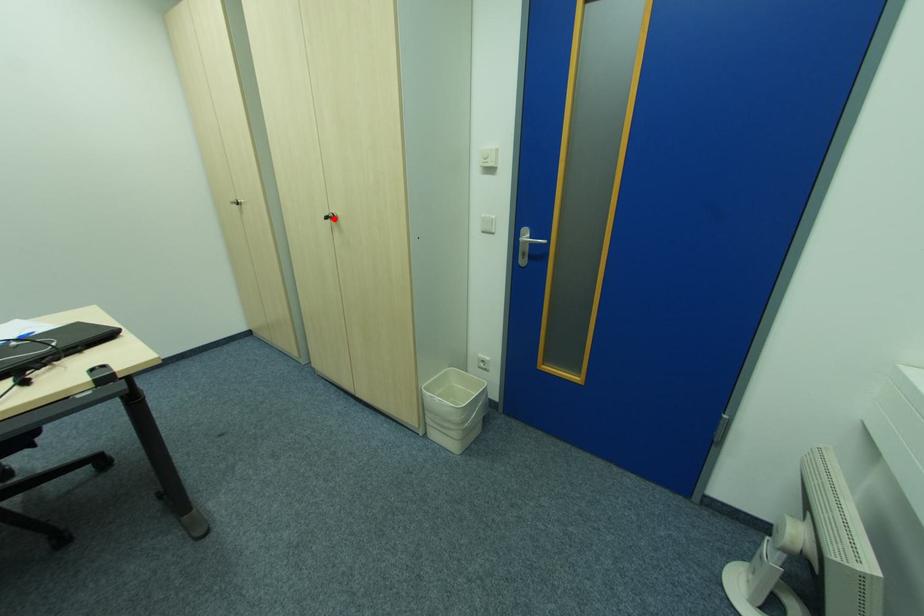
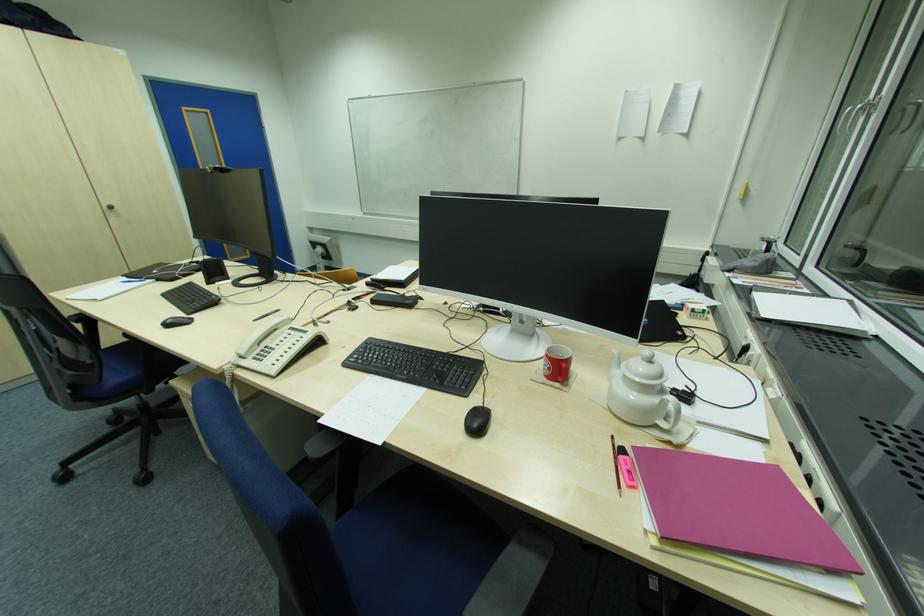
Question: I am providing you with two images of the same scene from different viewpoints. A red point is marked on the first image. At the location where the point appears in image 1, is it still visible in image 2?

Choices:
 (A) Yes
 (B) No

Answer: (A)